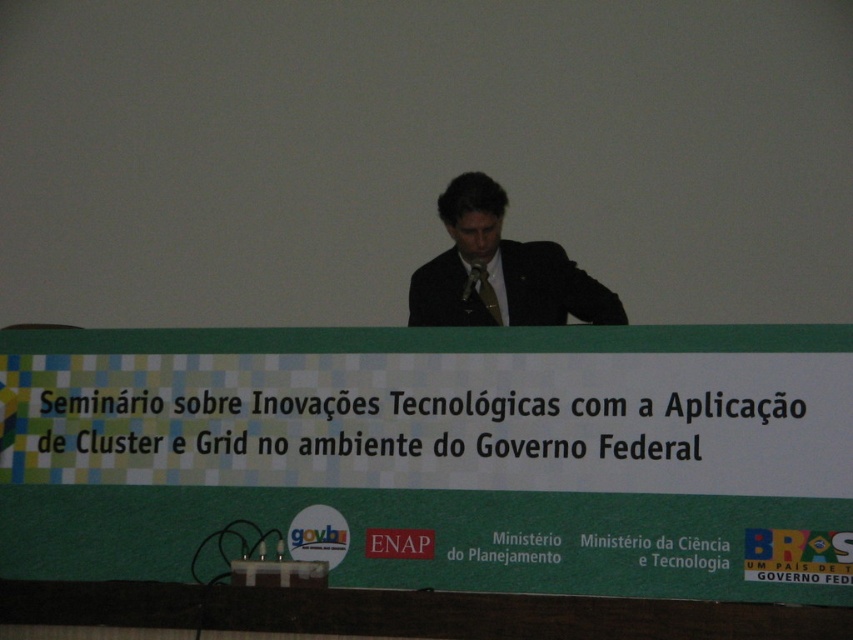
What is the spatial position of the green fabric banner at center in the image?

The green fabric banner at center is located at point (x=440, y=456) in the image.

You are an event photographer at the seminar. You need to take a photo of the speaker. Since the matte black suit at center and the matte brown tie at center are both important elements, which one should you focus on to ensure both are clearly visible in the photo?

The matte black suit at center is in front of the matte brown tie at center, so focusing on the matte black suit at center will ensure both elements are visible as the tie will be behind the suit in the composition.

You are an event organizer who needs to ensure that the green fabric banner at center is visible to all attendees. Considering the size relationship between the banner and the speaker in the matte black suit at center, what should you do to ensure visibility?

The green fabric banner at center is bigger than the matte black suit at center, so to ensure visibility, position the speaker closer to the banner or reduce the distance between them so the banner remains prominent.